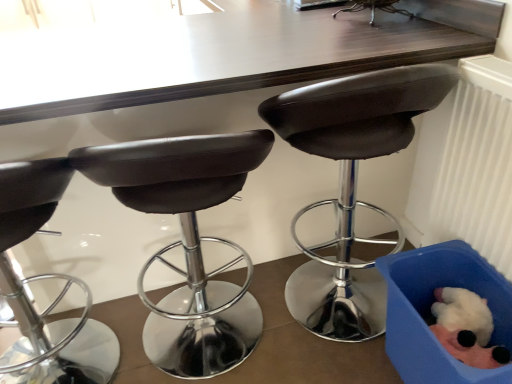
Question: Could you tell me if matte black stool at center, placed as the 3th chair when sorted from right to left, is turned towards white plastic radiator at right?

Choices:
 (A) yes
 (B) no

Answer: (B)

Question: Does matte black stool at center, the second chair from the left, have a smaller size compared to white plastic radiator at right?

Choices:
 (A) no
 (B) yes

Answer: (A)

Question: Does matte black stool at center, placed as the 3th chair when sorted from right to left, appear on the right side of white plastic radiator at right?

Choices:
 (A) no
 (B) yes

Answer: (A)

Question: Would you say white plastic radiator at right is part of matte black stool at center, the second chair from the left,'s contents?

Choices:
 (A) yes
 (B) no

Answer: (B)

Question: Is matte black stool at center, placed as the 3th chair when sorted from right to left, taller than white plastic radiator at right?

Choices:
 (A) yes
 (B) no

Answer: (B)

Question: Relative to white plastic radiator at right, is blue fabric box at lower right in front or behind?

Choices:
 (A) front
 (B) behind

Answer: (B)

Question: Do you think blue fabric box at lower right is within white plastic radiator at right, or outside of it?

Choices:
 (A) outside
 (B) inside

Answer: (A)

Question: In terms of height, does blue fabric box at lower right look taller or shorter compared to white plastic radiator at right?

Choices:
 (A) short
 (B) tall

Answer: (A)

Question: From the image's perspective, is blue fabric box at lower right located above or below white plastic radiator at right?

Choices:
 (A) below
 (B) above

Answer: (A)

Question: From a real-world perspective, is matte black stool at center, placed as the 3th chair when sorted from right to left, physically located above or below fluffy white plush toy at lower right?

Choices:
 (A) above
 (B) below

Answer: (A)

Question: In terms of height, does matte black stool at center, the second chair from the left, look taller or shorter compared to fluffy white plush toy at lower right?

Choices:
 (A) short
 (B) tall

Answer: (B)

Question: From the image's perspective, relative to fluffy white plush toy at lower right, is matte black stool at center, the second chair from the left, above or below?

Choices:
 (A) above
 (B) below

Answer: (A)

Question: Is matte black stool at center, placed as the 3th chair when sorted from right to left, in front of or behind fluffy white plush toy at lower right in the image?

Choices:
 (A) front
 (B) behind

Answer: (A)

Question: From the image's perspective, relative to matte black stool at center, the third chair in the left-to-right sequence, is blue fabric box at lower right above or below?

Choices:
 (A) below
 (B) above

Answer: (A)

Question: Visually, is blue fabric box at lower right positioned to the left or to the right of matte black stool at center, the third chair in the left-to-right sequence?

Choices:
 (A) left
 (B) right

Answer: (B)